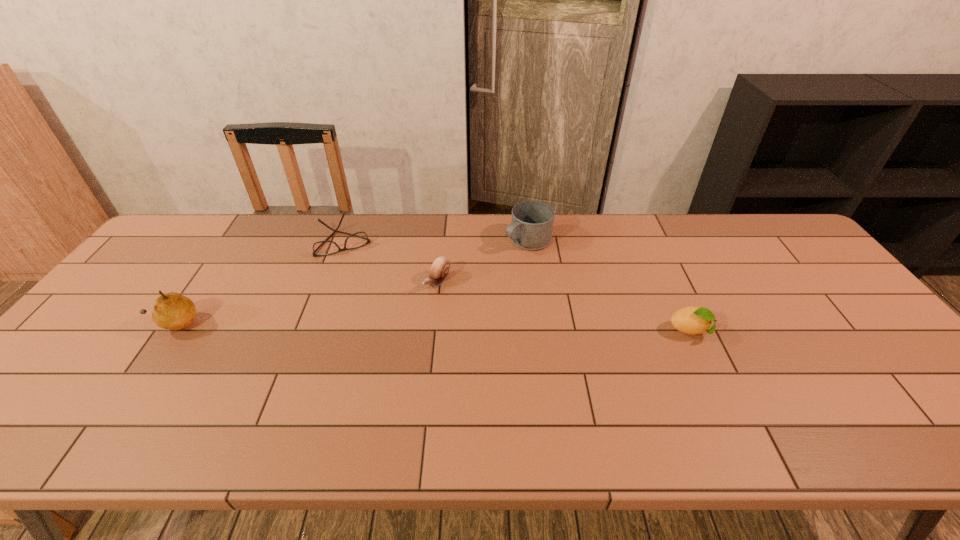
You are a GUI agent. You are given a task and a screenshot of the screen. Output one action in this format:
    pyautogui.click(x=<x>, y=<y>)
    Task: Click on the vacant space located 0.090m on the side of the fourth shortest object with the handle
    
    Given the screenshot: What is the action you would take?
    pyautogui.click(x=492, y=264)

Where is `vacant region located on the side of the fourth shortest object with the handle`? This screenshot has height=540, width=960. vacant region located on the side of the fourth shortest object with the handle is located at coordinates (490, 266).

Where is `vacant space located on the side of the fourth shortest object with the handle`? The image size is (960, 540). vacant space located on the side of the fourth shortest object with the handle is located at coordinates (463, 283).

In order to click on vacant space situated on the front-facing side of the spectacles in this screenshot , I will do pos(358,280).

Locate an element on the screen. The width and height of the screenshot is (960, 540). vacant space located on the front-facing side of the spectacles is located at coordinates (359, 285).

Identify the location of vacant area situated on the front-facing side of the spectacles. (377, 341).

Where is `blank area located on the front-facing side of the third nearest object`? The width and height of the screenshot is (960, 540). blank area located on the front-facing side of the third nearest object is located at coordinates (340, 373).

Where is `vacant space located on the front-facing side of the third nearest object`? vacant space located on the front-facing side of the third nearest object is located at coordinates (392, 326).

Locate an element on the screen. The width and height of the screenshot is (960, 540). free space located 0.190m on the front-facing side of the third nearest object is located at coordinates (381, 335).

The image size is (960, 540). I want to click on mug that is at the far edge, so click(x=531, y=228).